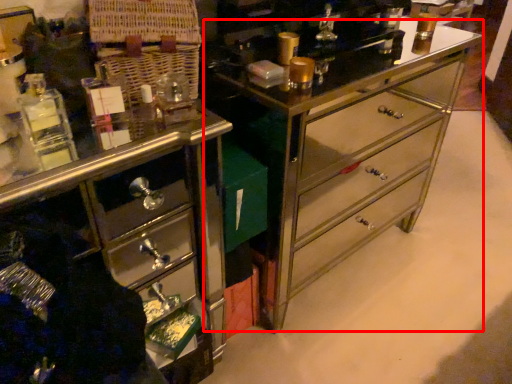
Question: From the image, what is the correct spatial relationship of counter (annotated by the red box) in relation to chest of drawers?

Choices:
 (A) left
 (B) right

Answer: (B)